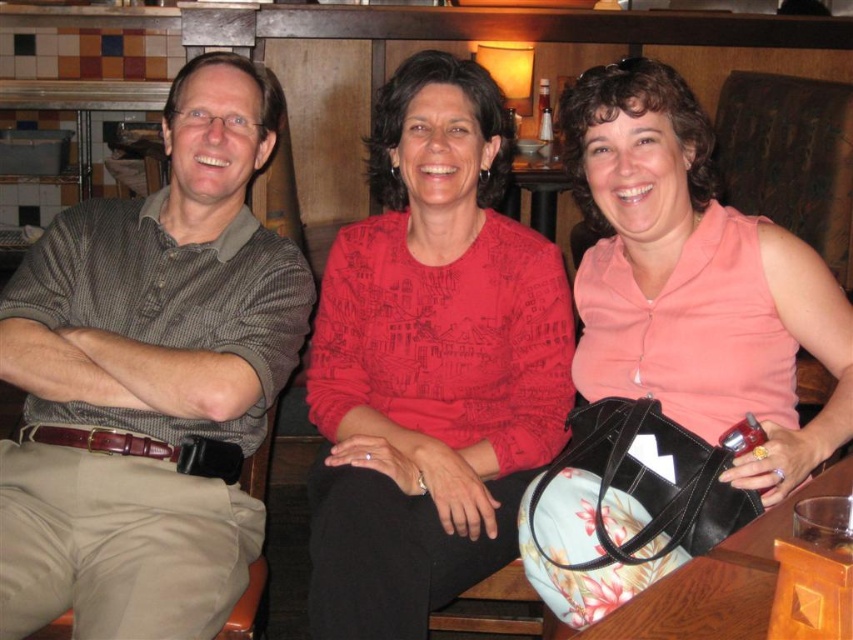
You are a server at a restaurant and need to place a 12 inch wide dessert plate between the matte brown shirt at left and the wooden table at lower right. Can the dessert plate fit in the space between them?

The space between the matte brown shirt at left and the wooden table at lower right is 34.29 inches. Since the dessert plate is only 12 inches wide, there is enough space to place it between them.

You are a photographer trying to capture the perfect shot of the matte red sweater at center. The camera has a focal point that can only focus on objects within a 0.1 unit radius around the center point at coordinates 0.5,0.5. Will the sweater be in focus?

The position of the matte red sweater at center is at point (x=430, y=362). The distance from the camera center point (x=426, y=320) is sqrt of squared differences in x and y coordinates. Calculating sqrt of squared 0.067 and 0.005 gives sqrt of 0.004489 and 0.000025. Sum is 0.004514, square root is approximately 0.0672 units. Since the focus radius is 0.1 units, the sweater is within the focus area and will be in focus.

You are standing in the dining area and want to place a small vase on the wooden table at lower right. The coordinates of the table are given as point (717,580). If your current position is at point 0.5, 0.5, what direction should you move to reach the wooden table at lower right?

To reach the wooden table at lower right located at point (717,580) from your current position at 0.5, 0.5, you should move in the direction of increasing both the x and y coordinates since the table is positioned to the lower right relative to the center.